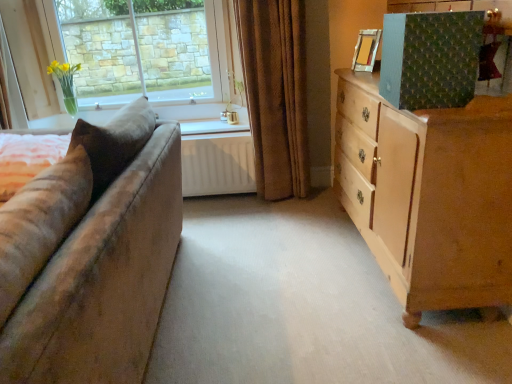
Question: From the image's perspective, is wooden picture frame at upper right located above white matte radiator at center?

Choices:
 (A) no
 (B) yes

Answer: (B)

Question: Is wooden picture frame at upper right surrounding white matte radiator at center?

Choices:
 (A) yes
 (B) no

Answer: (B)

Question: Can you confirm if wooden picture frame at upper right is thinner than white matte radiator at center?

Choices:
 (A) yes
 (B) no

Answer: (A)

Question: Is wooden picture frame at upper right oriented towards white matte radiator at center?

Choices:
 (A) yes
 (B) no

Answer: (B)

Question: Are wooden picture frame at upper right and white matte radiator at center far apart?

Choices:
 (A) no
 (B) yes

Answer: (B)

Question: Is wooden picture frame at upper right facing away from white matte radiator at center?

Choices:
 (A) yes
 (B) no

Answer: (B)

Question: Is clear glass vase at upper left thinner than light brown wooden chest of drawers at right?

Choices:
 (A) no
 (B) yes

Answer: (B)

Question: Considering the relative sizes of clear glass vase at upper left and light brown wooden chest of drawers at right in the image provided, is clear glass vase at upper left smaller than light brown wooden chest of drawers at right?

Choices:
 (A) yes
 (B) no

Answer: (A)

Question: Can you confirm if clear glass vase at upper left is positioned to the left of light brown wooden chest of drawers at right?

Choices:
 (A) no
 (B) yes

Answer: (B)

Question: From a real-world perspective, is clear glass vase at upper left positioned over light brown wooden chest of drawers at right based on gravity?

Choices:
 (A) yes
 (B) no

Answer: (A)

Question: Is light brown wooden chest of drawers at right completely or partially inside clear glass vase at upper left?

Choices:
 (A) yes
 (B) no

Answer: (B)

Question: From the image's perspective, is clear glass vase at upper left located above light brown wooden chest of drawers at right?

Choices:
 (A) yes
 (B) no

Answer: (A)

Question: From a real-world perspective, is white matte radiator at center on top of clear glass vase at upper left?

Choices:
 (A) yes
 (B) no

Answer: (B)